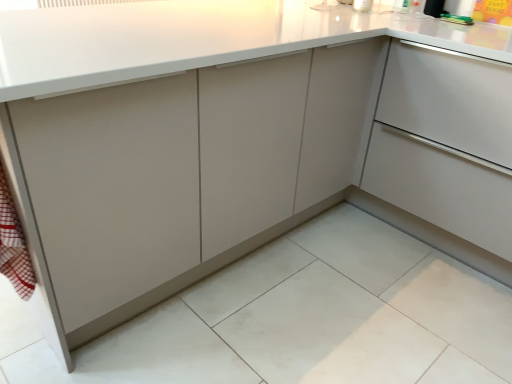
What do you see at coordinates (14, 244) in the screenshot?
I see `red checkered cloth at left` at bounding box center [14, 244].

Locate an element on the screen. Image resolution: width=512 pixels, height=384 pixels. red checkered cloth at left is located at coordinates (14, 244).

Where is `red checkered cloth at left`? red checkered cloth at left is located at coordinates pyautogui.click(x=14, y=244).